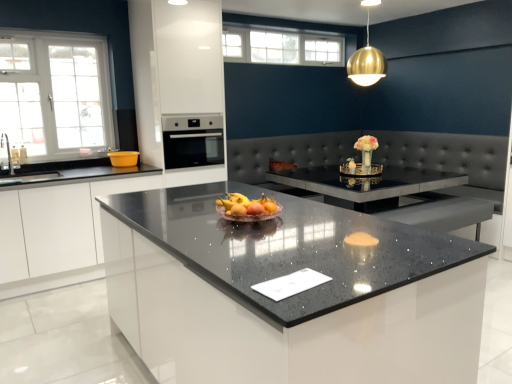
Question: Can you confirm if sparkling granite countertop at center is wider than satin black oven at center?

Choices:
 (A) yes
 (B) no

Answer: (A)

Question: From a real-world perspective, is sparkling granite countertop at center physically above satin black oven at center?

Choices:
 (A) no
 (B) yes

Answer: (A)

Question: Is sparkling granite countertop at center next to satin black oven at center?

Choices:
 (A) yes
 (B) no

Answer: (B)

Question: Is sparkling granite countertop at center located outside satin black oven at center?

Choices:
 (A) no
 (B) yes

Answer: (B)

Question: Considering the relative sizes of sparkling granite countertop at center and satin black oven at center in the image provided, is sparkling granite countertop at center bigger than satin black oven at center?

Choices:
 (A) no
 (B) yes

Answer: (B)

Question: Is white glossy cabinet at left to the left or to the right of sparkling granite countertop at center in the image?

Choices:
 (A) left
 (B) right

Answer: (A)

Question: Is white glossy cabinet at left spatially inside sparkling granite countertop at center, or outside of it?

Choices:
 (A) outside
 (B) inside

Answer: (A)

Question: From a real-world perspective, is white glossy cabinet at left positioned above or below sparkling granite countertop at center?

Choices:
 (A) below
 (B) above

Answer: (A)

Question: Based on their sizes in the image, would you say white glossy cabinet at left is bigger or smaller than sparkling granite countertop at center?

Choices:
 (A) big
 (B) small

Answer: (B)

Question: Looking at their shapes, would you say sparkling granite countertop at center is wider or thinner than white glass window at upper center, the second window when ordered from left to right?

Choices:
 (A) thin
 (B) wide

Answer: (B)

Question: Is point (372, 292) positioned closer to the camera than point (232, 59)?

Choices:
 (A) farther
 (B) closer

Answer: (B)

Question: Based on their sizes in the image, would you say sparkling granite countertop at center is bigger or smaller than white glass window at upper center, the 1th window positioned from the top?

Choices:
 (A) big
 (B) small

Answer: (A)

Question: From a real-world perspective, is sparkling granite countertop at center physically located above or below white glass window at upper center, arranged as the second window when viewed from the front?

Choices:
 (A) below
 (B) above

Answer: (A)

Question: From their relative heights in the image, would you say satin black oven at center is taller or shorter than white glossy cabinet at left?

Choices:
 (A) tall
 (B) short

Answer: (B)

Question: Considering the relative positions of satin black oven at center and white glossy cabinet at left in the image provided, is satin black oven at center to the left or to the right of white glossy cabinet at left?

Choices:
 (A) left
 (B) right

Answer: (B)